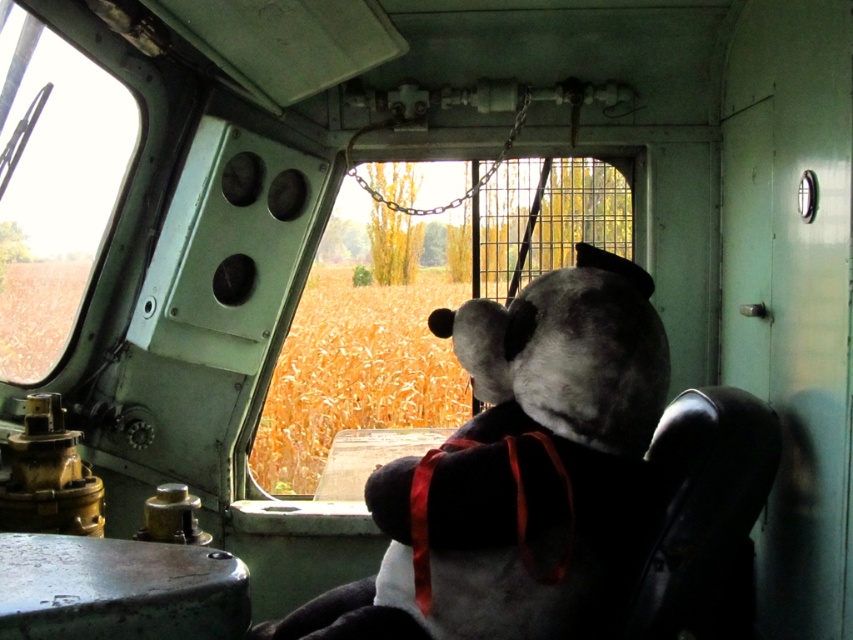
You are a passenger in the vehicle and want to see outside through the transparent glass window at upper left. However, the soft plush teddy bear at center is blocking your view. Can you move the teddy bear to the left to clear your view?

The soft plush teddy bear at center is to the right of the transparent glass window at upper left, so moving it to the left would place it closer to the window. This might not clear your view since it would still be in front of the window. Alternatively, moving it to the right would move it away from the window, potentially clearing the view.

You are a passenger in the vehicle and want to look outside through the windows. Which window, the clear glass window at center or the transparent glass window at upper left, allows you to see a wider view of the outside?

The clear glass window at center allows you to see a wider view of the outside because it is larger in size than the transparent glass window at upper left.

You are inside a vehicle and need to move from point A to point B. The coordinates for point A are point (77, 298), and point B are point (399, 472). According to the image, which direction should you move to reach point B from point A?

To reach point B from point A, you should move forward since point (399, 472) is in front of point (77, 298).